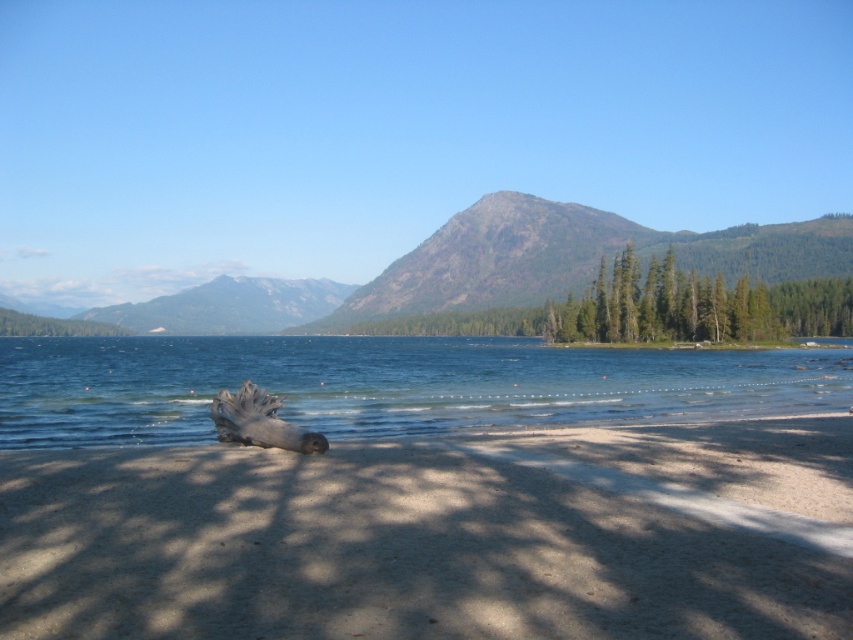
You are a swimmer who wants to reach the green textured trees at center from the clear water at beach center. Given that your swimming speed is 1.5 meters per second, how long will it take you to swim to the trees?

The distance between the clear water at beach center and the green textured trees at center is 44.35 meters. At a swimming speed of 1.5 meters per second, it would take approximately 29.57 seconds to reach the trees.

You are standing at the lakeside and want to take a photo of the green textured mountain at center. If your camera has a maximum zoom range of 100 meters, will you be able to capture the entire mountain in the photo without moving closer?

The distance between you and the green textured mountain at center is 105.29 meters, which exceeds the camera maximum zoom range of 100 meters. Therefore, you won not be able to capture the entire mountain in the photo without moving closer.

Looking at this image, you are standing at the lakeside and want to walk from the clear water at beach center to the green textured trees at center. Which direction should you head to reach the trees?

The clear water at beach center is positioned on the left side of green textured trees at center, so you should head to the right to reach the trees.